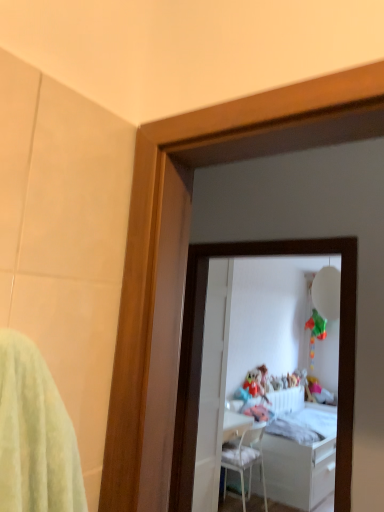
Question: From the image's perspective, is white glossy bed at center below white glossy door at center?

Choices:
 (A) no
 (B) yes

Answer: (B)

Question: Is white glossy bed at center smaller than white glossy door at center?

Choices:
 (A) no
 (B) yes

Answer: (A)

Question: Can you confirm if white glossy bed at center is taller than white glossy door at center?

Choices:
 (A) yes
 (B) no

Answer: (B)

Question: Considering the relative positions of white glossy bed at center and white glossy door at center in the image provided, is white glossy bed at center to the right of white glossy door at center from the viewer's perspective?

Choices:
 (A) no
 (B) yes

Answer: (B)

Question: Is white glossy bed at center not inside white glossy door at center?

Choices:
 (A) no
 (B) yes

Answer: (B)

Question: From the image's perspective, is white glossy bed at center located above or below white glossy door at center?

Choices:
 (A) above
 (B) below

Answer: (B)

Question: Considering the positions of white glossy bed at center and white glossy door at center in the image, is white glossy bed at center bigger or smaller than white glossy door at center?

Choices:
 (A) big
 (B) small

Answer: (A)

Question: Does point (274, 445) appear closer or farther from the camera than point (205, 419)?

Choices:
 (A) farther
 (B) closer

Answer: (A)

Question: Would you say white glossy bed at center is to the left or to the right of white glossy door at center in the picture?

Choices:
 (A) left
 (B) right

Answer: (B)

Question: Is point (311, 412) positioned closer to the camera than point (215, 365)?

Choices:
 (A) farther
 (B) closer

Answer: (A)

Question: In the image, is white glossy mirror at center positioned in front of or behind white glossy door at center?

Choices:
 (A) front
 (B) behind

Answer: (A)

Question: In terms of width, does white glossy mirror at center look wider or thinner when compared to white glossy door at center?

Choices:
 (A) thin
 (B) wide

Answer: (B)

Question: Is white glossy mirror at center to the left or to the right of white glossy door at center in the image?

Choices:
 (A) right
 (B) left

Answer: (A)

Question: From a real-world perspective, is white plastic chair at center physically located above or below white glossy bed at center?

Choices:
 (A) below
 (B) above

Answer: (A)

Question: In terms of size, does white plastic chair at center appear bigger or smaller than white glossy bed at center?

Choices:
 (A) small
 (B) big

Answer: (A)